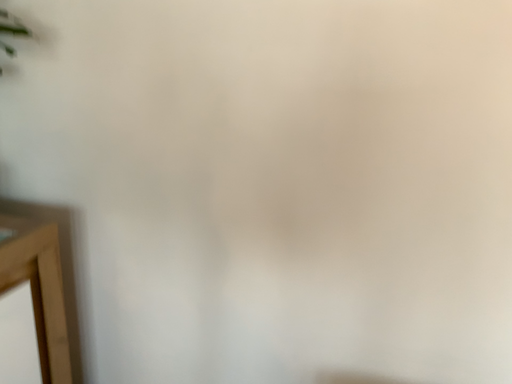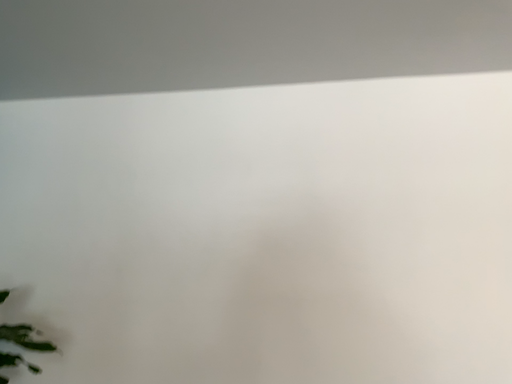
Question: Which way did the camera rotate in the video?

Choices:
 (A) rotated left
 (B) rotated right

Answer: (B)